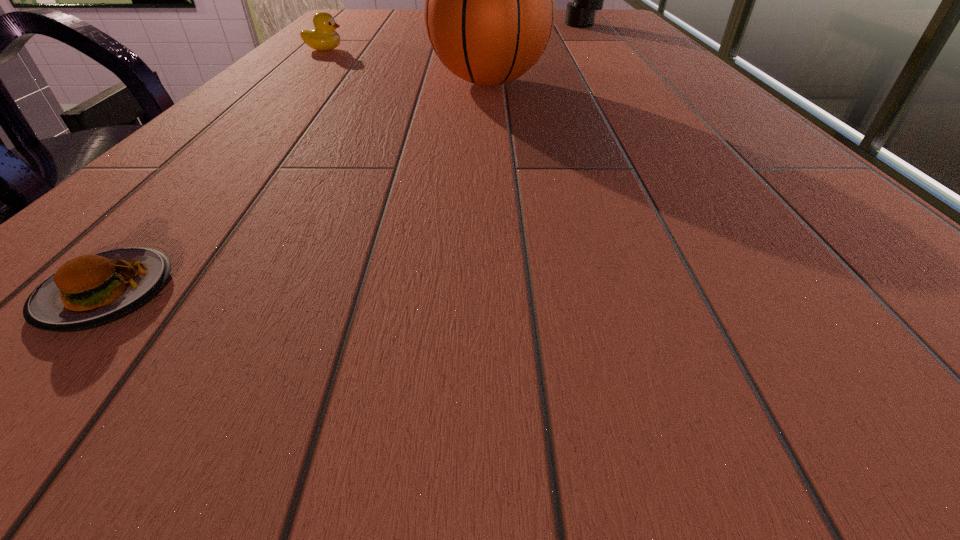
What are the coordinates of `the rightmost object` in the screenshot? It's located at (581, 12).

Image resolution: width=960 pixels, height=540 pixels. In order to click on wine bottle in this screenshot , I will do `click(581, 12)`.

In order to click on the third shortest object in this screenshot , I will do `click(489, 12)`.

The image size is (960, 540). Find the location of `the second nearest object`. the second nearest object is located at coordinates (489, 12).

Find the location of `duckling`. duckling is located at coordinates (324, 37).

Identify the location of the third tallest object. This screenshot has height=540, width=960. click(x=324, y=37).

The height and width of the screenshot is (540, 960). I want to click on free space located 0.050m on the left of the tallest object, so click(x=548, y=25).

The image size is (960, 540). Find the location of `free space located on the right of the basketball`. free space located on the right of the basketball is located at coordinates (592, 83).

At what (x,y) coordinates should I click in order to perform the action: click on free region located 0.050m on the beak of the third tallest object. Please return your answer as a coordinate pair (x, y). Looking at the image, I should click on (365, 50).

Identify the location of object that is at the far edge. This screenshot has width=960, height=540. (581, 12).